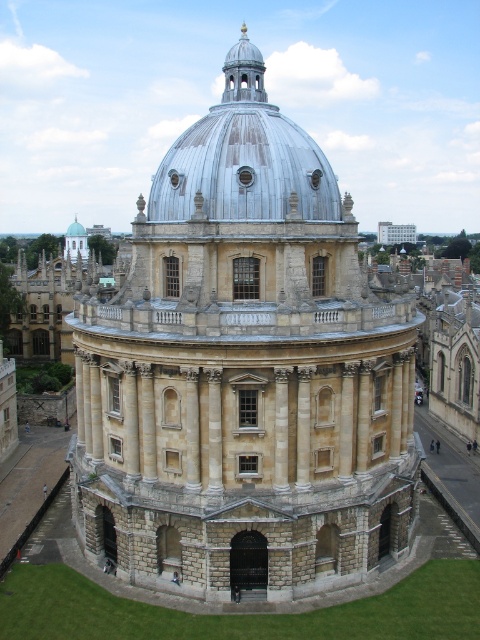
Question: Which object is closer to the camera taking this photo?

Choices:
 (A) beige stone dome at center
 (B) metallic silver dome at center

Answer: (A)

Question: Is beige stone dome at center positioned before metallic silver dome at center?

Choices:
 (A) no
 (B) yes

Answer: (B)

Question: Observing the image, what is the correct spatial positioning of beige stone dome at center in reference to metallic silver dome at center?

Choices:
 (A) right
 (B) left

Answer: (A)

Question: Does beige stone dome at center appear under metallic silver dome at center?

Choices:
 (A) yes
 (B) no

Answer: (A)